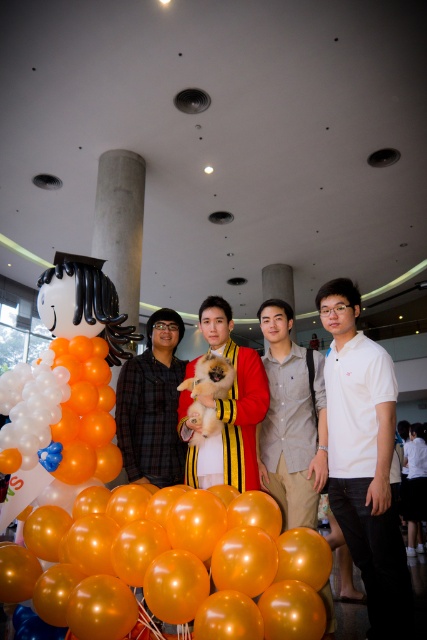
You are a photographer positioned at the entrance of the event venue. You want to take a photo that includes both the white cotton polo shirt at right and the fluffy fur dog at center. Which object should you adjust your camera angle to focus on first to ensure both are in frame?

The white cotton polo shirt at right is much taller than the fluffy fur dog at center. To ensure both are in frame, focus on the taller object first, which is the white cotton polo shirt at right, then adjust the angle to include the fluffy fur dog at center.

You are attending a party and notice two items in the scene described. The first is a white cotton polo shirt at right, and the second is a fluffy fur dog at center. Which of these two items is larger in size?

The white cotton polo shirt at right is bigger than the fluffy fur dog at center.